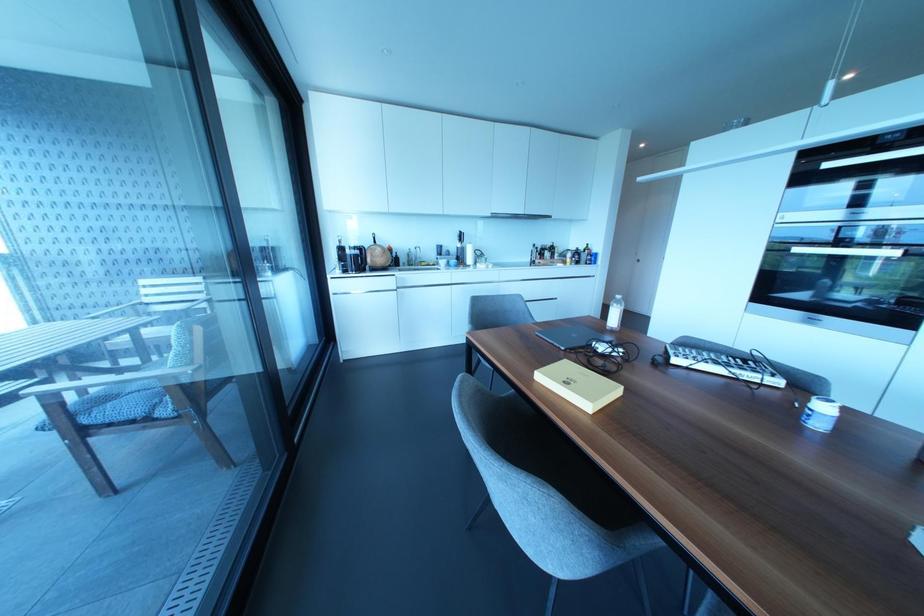
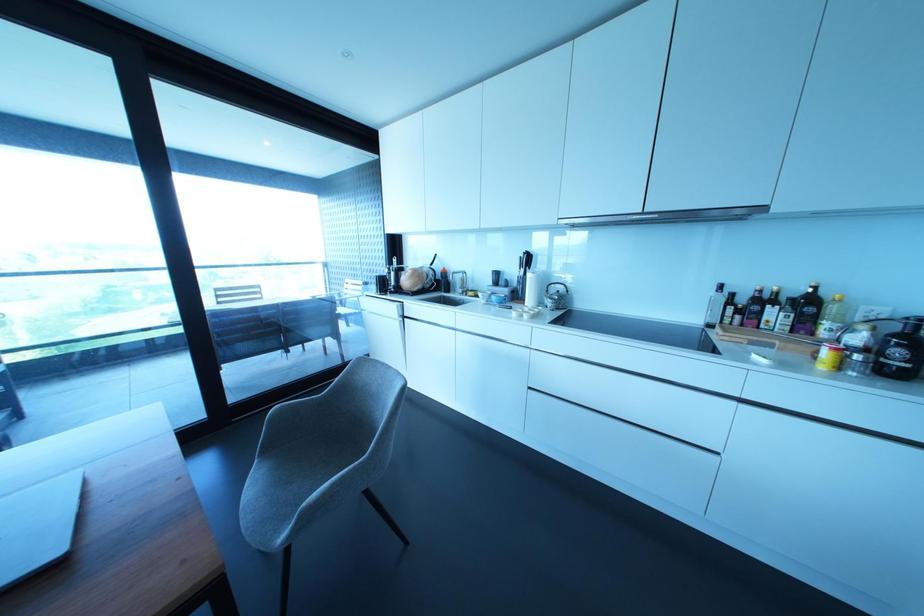
In the second image, find the point that corresponds to (459,236) in the first image.

(527, 259)